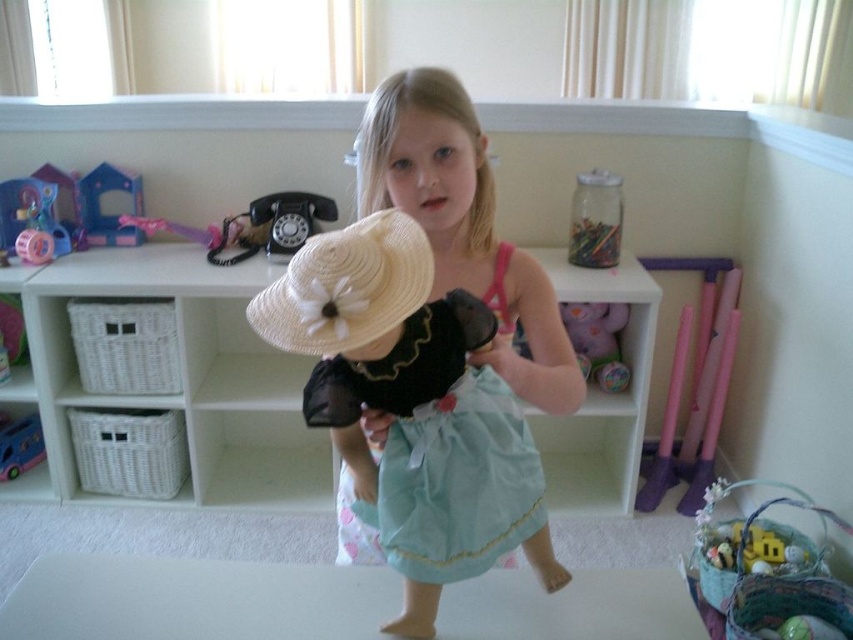
Is black plastic rotary phone at upper center to the right of yellow matte plush toy at lower right from the viewer's perspective?

No, black plastic rotary phone at upper center is not to the right of yellow matte plush toy at lower right.

Between black plastic rotary phone at upper center and yellow matte plush toy at lower right, which one has less height?

With less height is yellow matte plush toy at lower right.

Locate an element on the screen. black plastic rotary phone at upper center is located at coordinates (274, 225).

Where is `black plastic rotary phone at upper center`? The image size is (853, 640). black plastic rotary phone at upper center is located at coordinates (274, 225).

Is point (602, 314) positioned behind point (9, 227)?

That is False.

Is matte purple plush at center wider than matte plastic toy at left?

In fact, matte purple plush at center might be narrower than matte plastic toy at left.

Who is more forward, (589, 364) or (27, 180)?

Point (589, 364)

This screenshot has height=640, width=853. I want to click on matte purple plush at center, so click(596, 340).

Between point (628, 468) and point (593, 320), which one is positioned in front?

Point (628, 468)

Identify the location of white wicker basket at center. The width and height of the screenshot is (853, 640). (183, 380).